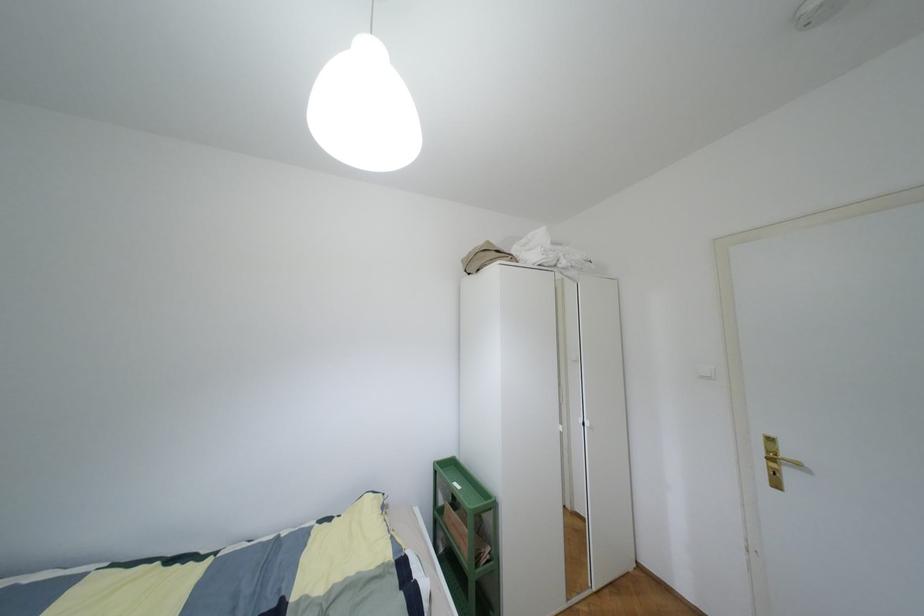
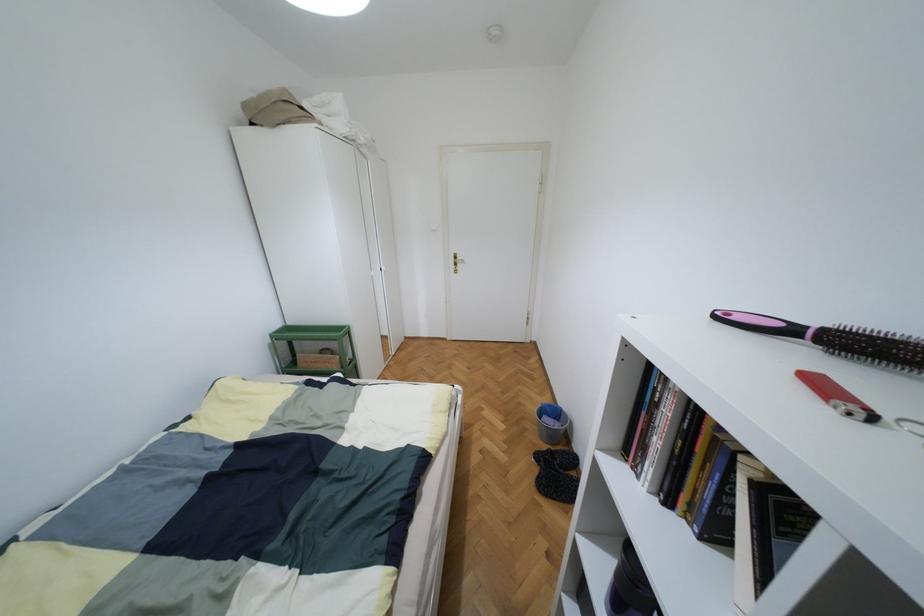
The first image is from the beginning of the video and the second image is from the end. How did the camera likely rotate when shooting the video?

The rotation direction of the camera is right-down.